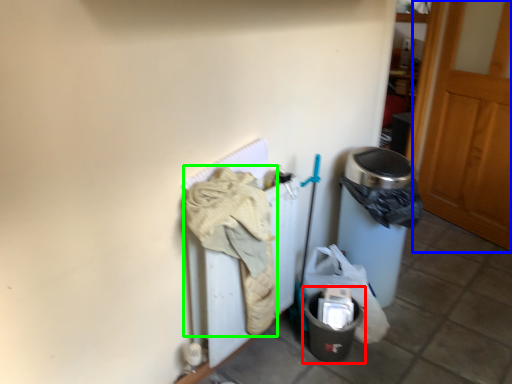
Question: Based on their relative distances, which object is nearer to recycling bin (highlighted by a red box)? Choose from door (highlighted by a blue box) and clothing (highlighted by a green box).

Choices:
 (A) door
 (B) clothing

Answer: (B)